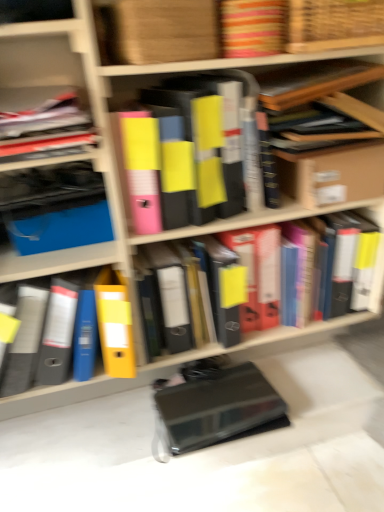
The image size is (384, 512). I want to click on vacant area that lies to the right of black matte book at lower center, so click(x=303, y=381).